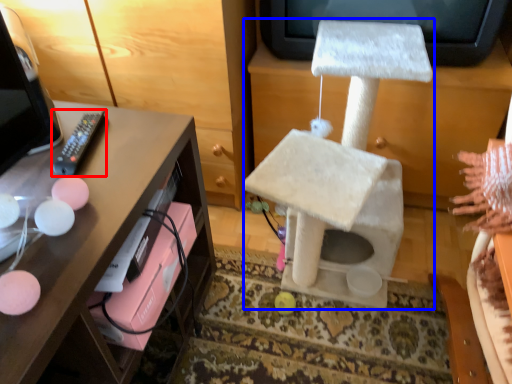
Question: Which object is closer to the camera taking this photo, remote (highlighted by a red box) or swivel chair (highlighted by a blue box)?

Choices:
 (A) remote
 (B) swivel chair

Answer: (B)